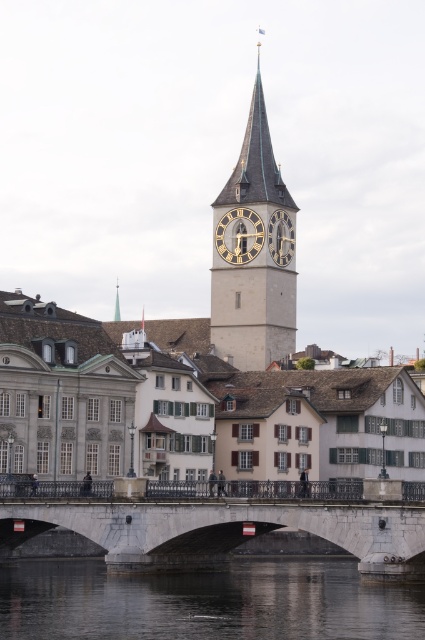
Does white stone bridge at center have a lesser width compared to gold/brass/golden clock at center?

In fact, white stone bridge at center might be wider than gold/brass/golden clock at center.

Does white stone bridge at center have a greater height compared to gold/brass/golden clock at center?

Yes.

Which is behind, point (396, 547) or point (232, 225)?

The point (232, 225) is more distant.

The width and height of the screenshot is (425, 640). Identify the location of white stone bridge at center. (221, 520).

Who is shorter, transparent water at center or white stone bridge at center?

transparent water at center

Does point (169, 589) come farther from viewer compared to point (363, 481)?

Yes, it is.

Is point (328, 564) closer to viewer compared to point (181, 548)?

No, (328, 564) is behind (181, 548).

You are a GUI agent. You are given a task and a screenshot of the screen. Output one action in this format:
    pyautogui.click(x=<x>, y=<y>)
    Task: Click on the transparent water at center
    
    Given the screenshot: What is the action you would take?
    pyautogui.click(x=206, y=602)

Can you confirm if white stone bridge at center is positioned to the left of gold metallic clock at center?

Correct, you'll find white stone bridge at center to the left of gold metallic clock at center.

Image resolution: width=425 pixels, height=640 pixels. I want to click on white stone bridge at center, so click(221, 520).